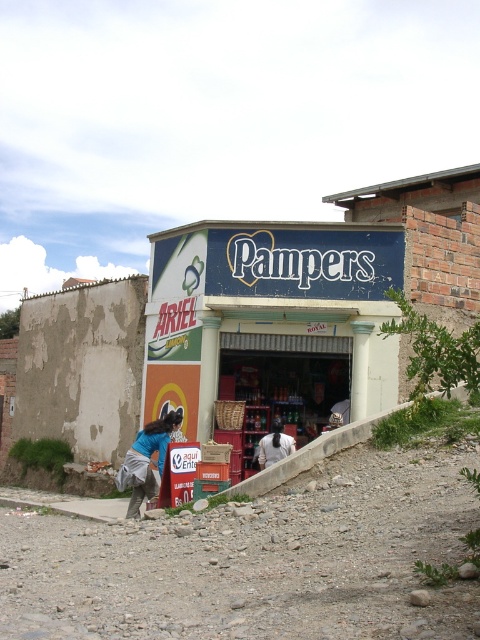
You are a customer standing on the dirt path in front of the store. You see a blue fabric shirt at lower center and a white fabric at center. Which fabric is more to the left?

The blue fabric shirt at lower center is more to the left than the white fabric at center.